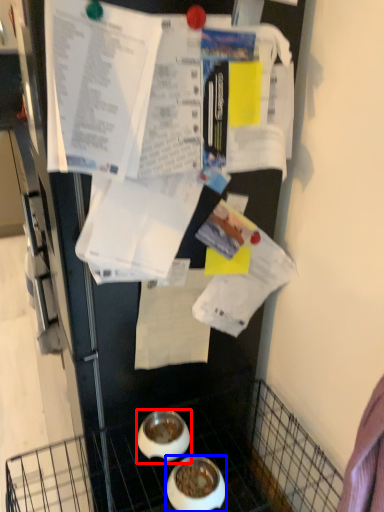
Question: Which point is closer to the camera, bowl (highlighted by a red box) or bowl (highlighted by a blue box)?

Choices:
 (A) bowl
 (B) bowl

Answer: (B)